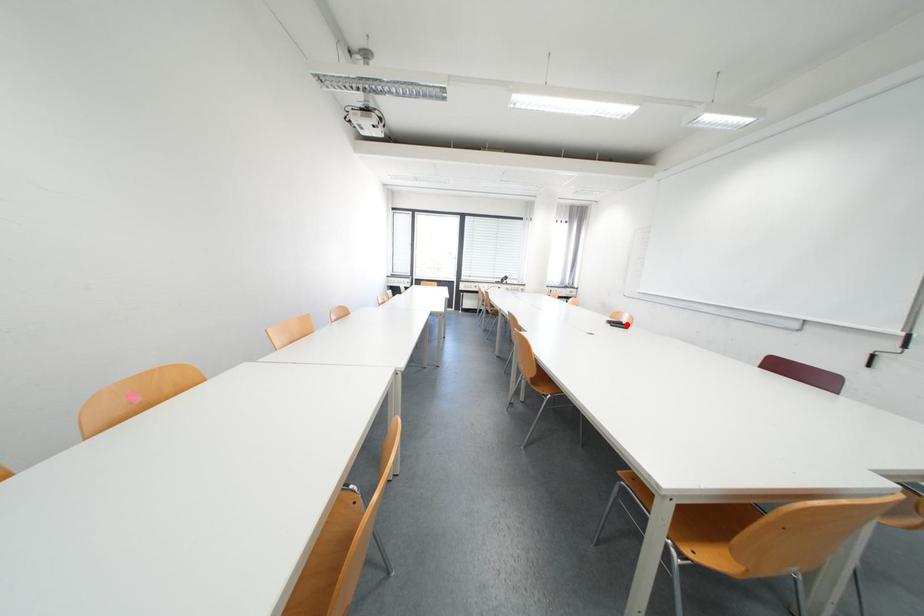
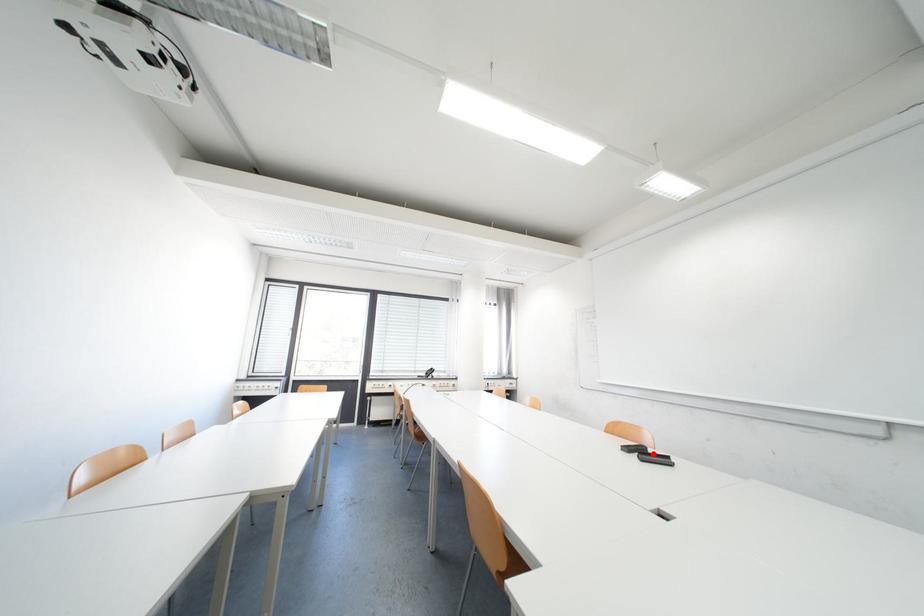
I am providing you with two images of the same scene from different viewpoints. A red point is marked on the first image and another point is marked on the second image. Is the marked point in image1 the same physical position as the marked point in image2?

Yes